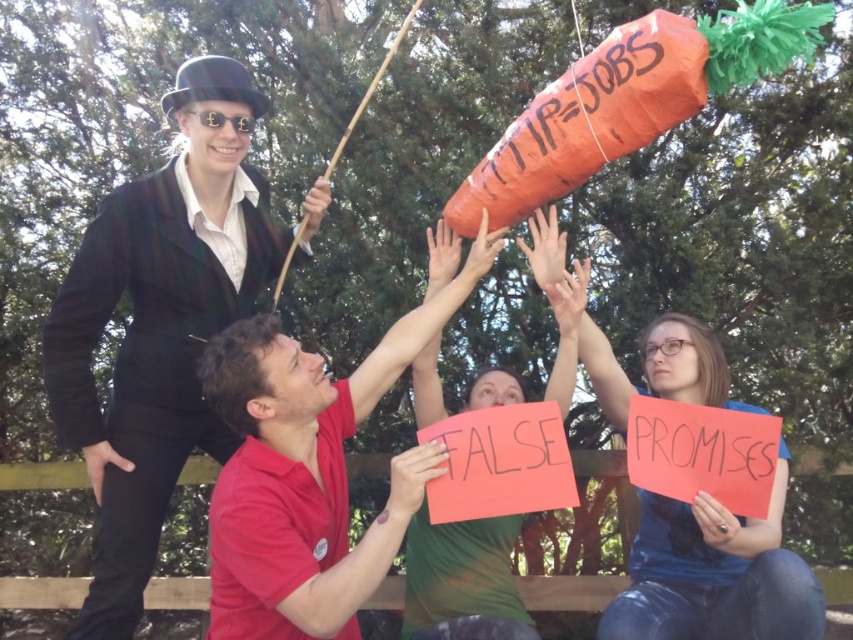
You are a photographer trying to capture a clear shot of the matte black suit at upper left and the green fabric shirt at center. Based on their heights, which one is more likely to be obscured by the other?

The matte black suit at upper left is taller than the green fabric shirt at center, so it is more likely to obscure the view of the green fabric shirt at center.

You are a photographer trying to capture the protest scene. You notice the red cotton shirt at center and the blue denim jeans at lower right. Which object should you focus on first to ensure both are in the frame without moving the camera?

The red cotton shirt at center is closer to the viewer than the blue denim jeans at lower right, so focus on the red cotton shirt at center first to ensure both are in the frame without moving the camera.

You are a photographer trying to capture a clear shot of the red cotton shirt at center and the blue denim jeans at lower right. Based on their positions, which object should you focus on first to ensure both are in frame?

The red cotton shirt at center is located above the blue denim jeans at lower right, so you should focus on the red cotton shirt at center first to ensure both are in frame.